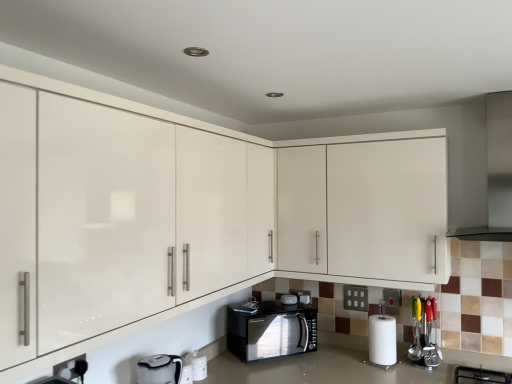
Identify the location of free space below satin silver exhaust hood at upper right (from a real-world perspective). (480, 370).